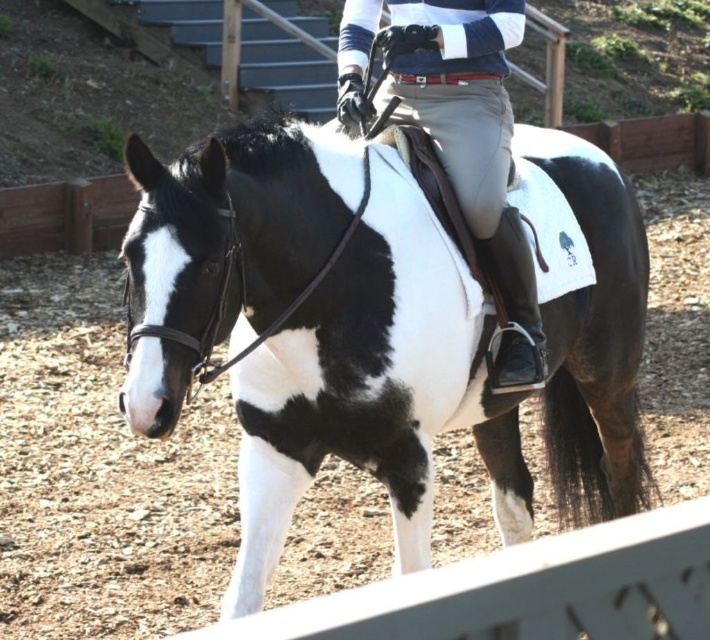
Is black and white speckled horse at center below light gray pants at center?

Correct, black and white speckled horse at center is located below light gray pants at center.

Is black and white speckled horse at center to the left of light gray pants at center from the viewer's perspective?

→ Correct, you'll find black and white speckled horse at center to the left of light gray pants at center.

Where is `black and white speckled horse at center`? This screenshot has width=710, height=640. black and white speckled horse at center is located at coordinates (373, 385).